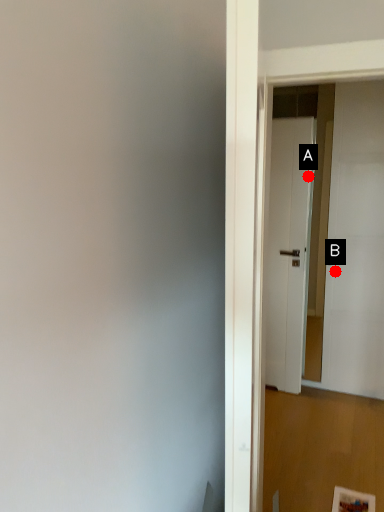
Question: Two points are circled on the image, labeled by A and B beside each circle. Which point is farther to the camera?

Choices:
 (A) A is further
 (B) B is further

Answer: (B)